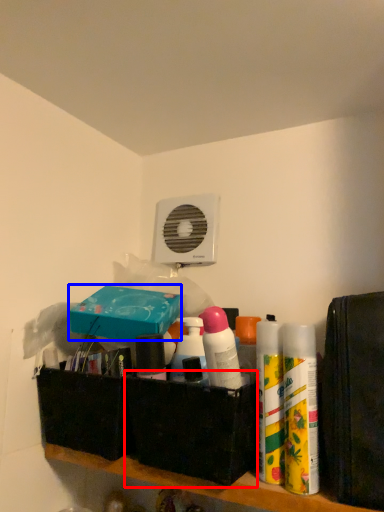
Question: Among these objects, which one is farthest to the camera, box (highlighted by a red box) or box (highlighted by a blue box)?

Choices:
 (A) box
 (B) box

Answer: (B)